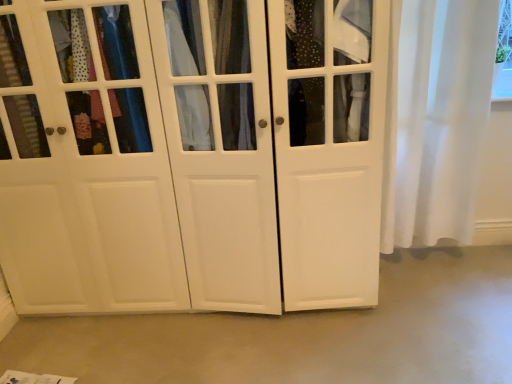
Find the location of `white sheer curtain at right`. white sheer curtain at right is located at coordinates (439, 119).

Measure the distance between point [426,183] and camera.

A distance of 1.91 meters exists between point [426,183] and camera.

This screenshot has height=384, width=512. Describe the element at coordinates (302, 334) in the screenshot. I see `smooth concrete floor at center` at that location.

The height and width of the screenshot is (384, 512). What do you see at coordinates (196, 156) in the screenshot? I see `white matte cabinet at center` at bounding box center [196, 156].

At what (x,y) coordinates should I click in order to perform the action: click on white sheer curtain at right. Please return your answer as a coordinate pair (x, y). Looking at the image, I should click on (439, 119).

I want to click on curtain below the white matte cabinet at center (from a real-world perspective), so click(439, 119).

Can you confirm if white sheer curtain at right is shorter than white matte cabinet at center?

Indeed, white sheer curtain at right has a lesser height compared to white matte cabinet at center.

Is white matte cabinet at center looking in the opposite direction of white sheer curtain at right?

No, white matte cabinet at center is not facing the opposite direction of white sheer curtain at right.

In the scene shown: Is white matte cabinet at center with white sheer curtain at right?

white matte cabinet at center and white sheer curtain at right are clearly separated.

From the image's perspective, is white matte cabinet at center over white sheer curtain at right?

No, from the image's perspective, white matte cabinet at center is not on top of white sheer curtain at right.

Considering the positions of point (240, 332) and point (209, 77), is point (240, 332) closer or farther from the camera than point (209, 77)?

Point (240, 332) is positioned farther from the camera compared to point (209, 77).

Locate an element on the screen. This screenshot has height=384, width=512. concrete below the white matte cabinet at center (from the image's perspective) is located at coordinates (302, 334).

Looking at this image, is smooth concrete floor at center not close to white matte cabinet at center?

No, smooth concrete floor at center is not far away from white matte cabinet at center.

From a real-world perspective, does smooth concrete floor at center stand above white matte cabinet at center?

No, from a real-world perspective, smooth concrete floor at center is not on top of white matte cabinet at center.

Considering the sizes of objects smooth concrete floor at center and white sheer curtain at right in the image provided, who is smaller, smooth concrete floor at center or white sheer curtain at right?

smooth concrete floor at center.

Locate an element on the screen. This screenshot has width=512, height=384. curtain that is behind the smooth concrete floor at center is located at coordinates (439, 119).

Considering the sizes of objects smooth concrete floor at center and white sheer curtain at right in the image provided, who is shorter, smooth concrete floor at center or white sheer curtain at right?

smooth concrete floor at center is shorter.

Considering the sizes of smooth concrete floor at center and white sheer curtain at right in the image, is smooth concrete floor at center wider or thinner than white sheer curtain at right?

Clearly, smooth concrete floor at center has more width compared to white sheer curtain at right.

Which is behind, point (383, 226) or point (312, 368)?

The point (383, 226) is more distant.

Is white sheer curtain at right in contact with smooth concrete floor at center?

No, white sheer curtain at right is not beside smooth concrete floor at center.

From a real-world perspective, which object rests below the other?

smooth concrete floor at center, from a real-world perspective.

Can you tell me how much white sheer curtain at right and smooth concrete floor at center differ in facing direction?

The angular difference between white sheer curtain at right and smooth concrete floor at center is 1.62 degrees.

From a real-world perspective, is white matte cabinet at center physically located above or below smooth concrete floor at center?

In terms of real-world spatial position, white matte cabinet at center is above smooth concrete floor at center.

Does white matte cabinet at center contain smooth concrete floor at center?

That's incorrect, smooth concrete floor at center is not inside white matte cabinet at center.

Measure the distance from white matte cabinet at center to smooth concrete floor at center.

white matte cabinet at center is 20.72 inches from smooth concrete floor at center.

Does white matte cabinet at center have a larger size compared to smooth concrete floor at center?

Correct, white matte cabinet at center is larger in size than smooth concrete floor at center.

Find the location of a particular element. This screenshot has height=384, width=512. curtain to the right of white matte cabinet at center is located at coordinates (439, 119).

In the image, there is a white sheer curtain at right. What are the coordinates of `cupboard below it (from the image's perspective)` in the screenshot? It's located at (196, 156).

From the image, which object appears to be farther from smooth concrete floor at center, white matte cabinet at center or white sheer curtain at right?

Among the two, white sheer curtain at right is located further to smooth concrete floor at center.

Which object lies nearer to the anchor point white matte cabinet at center, white sheer curtain at right or smooth concrete floor at center?

smooth concrete floor at center.

Looking at the image, which one is located closer to white sheer curtain at right, white matte cabinet at center or smooth concrete floor at center?

white matte cabinet at center is positioned closer to the anchor white sheer curtain at right.

Estimate the real-world distances between objects in this image. Which object is closer to white matte cabinet at center, smooth concrete floor at center or white sheer curtain at right?

smooth concrete floor at center lies closer to white matte cabinet at center than the other object.

Estimate the real-world distances between objects in this image. Which object is further from white sheer curtain at right, smooth concrete floor at center or white matte cabinet at center?

Among the two, smooth concrete floor at center is located further to white sheer curtain at right.

From the image, which object appears to be nearer to smooth concrete floor at center, white sheer curtain at right or white matte cabinet at center?

white matte cabinet at center.

Where is `concrete situated between white matte cabinet at center and white sheer curtain at right from left to right`? concrete situated between white matte cabinet at center and white sheer curtain at right from left to right is located at coordinates (302, 334).